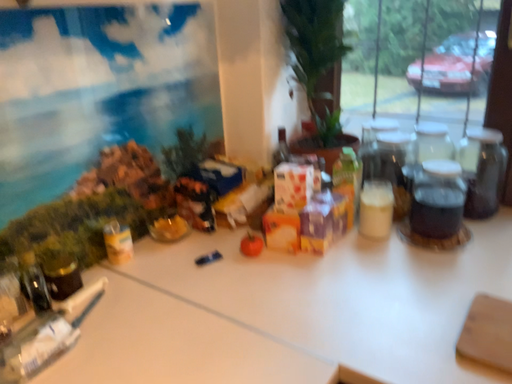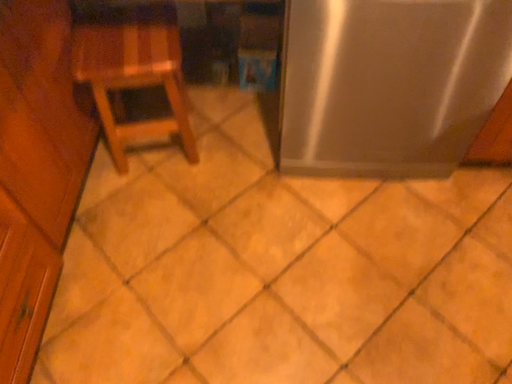
Question: How did the camera likely rotate when shooting the video?

Choices:
 (A) rotated right
 (B) rotated left

Answer: (A)